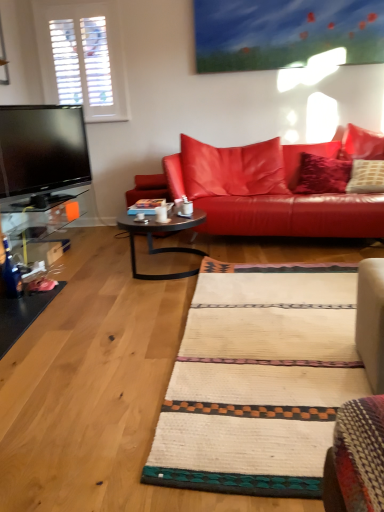
Question: From a real-world perspective, is leather couch at center above or below metallic black coffee table at center?

Choices:
 (A) above
 (B) below

Answer: (A)

Question: Based on their sizes in the image, would you say leather couch at center is bigger or smaller than metallic black coffee table at center?

Choices:
 (A) big
 (B) small

Answer: (A)

Question: Considering the real-world distances, which object is farthest from the white glossy mug at center?

Choices:
 (A) leather couch at center
 (B) metallic black coffee table at center

Answer: (A)

Question: Which object is the farthest from the leather couch at center?

Choices:
 (A) white glossy mug at center
 (B) metallic black coffee table at center

Answer: (A)